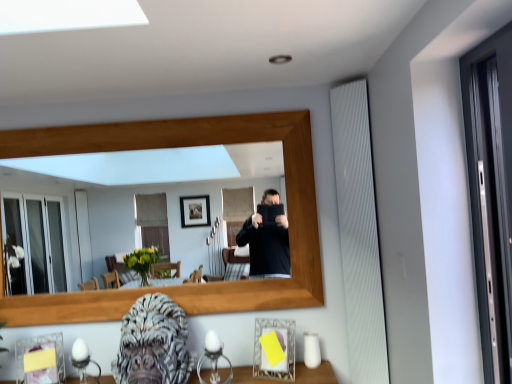
Question: From the image's perspective, would you say wooden frame at center is positioned over gray textured gorilla head at lower center?

Choices:
 (A) yes
 (B) no

Answer: (A)

Question: Does wooden frame at center have a smaller size compared to gray textured gorilla head at lower center?

Choices:
 (A) no
 (B) yes

Answer: (A)

Question: Is wooden frame at center at the right side of gray textured gorilla head at lower center?

Choices:
 (A) yes
 (B) no

Answer: (B)

Question: Is wooden frame at center taller than gray textured gorilla head at lower center?

Choices:
 (A) yes
 (B) no

Answer: (A)

Question: From a real-world perspective, is wooden frame at center beneath gray textured gorilla head at lower center?

Choices:
 (A) no
 (B) yes

Answer: (A)

Question: From a real-world perspective, is wooden frame at center on gray textured gorilla head at lower center?

Choices:
 (A) yes
 (B) no

Answer: (A)

Question: Can you confirm if gray textured gorilla head at lower center is positioned to the left of matte glass picture frame at lower right, which is counted as the 2th picture frame, starting from the left?

Choices:
 (A) no
 (B) yes

Answer: (B)

Question: Is gray textured gorilla head at lower center beside matte glass picture frame at lower right, which is counted as the 2th picture frame, starting from the left?

Choices:
 (A) no
 (B) yes

Answer: (A)

Question: Is gray textured gorilla head at lower center far from matte glass picture frame at lower right, which is counted as the 2th picture frame, starting from the left?

Choices:
 (A) no
 (B) yes

Answer: (A)

Question: Is gray textured gorilla head at lower center outside of matte glass picture frame at lower right, which is counted as the 2th picture frame, starting from the left?

Choices:
 (A) no
 (B) yes

Answer: (B)

Question: Does gray textured gorilla head at lower center have a greater width compared to matte glass picture frame at lower right, which is counted as the 2th picture frame, starting from the left?

Choices:
 (A) yes
 (B) no

Answer: (A)

Question: From a real-world perspective, is gray textured gorilla head at lower center on top of matte glass picture frame at lower right, which is counted as the 1th picture frame, starting from the right?

Choices:
 (A) no
 (B) yes

Answer: (B)

Question: From a real-world perspective, is matte glass picture frame at lower right, which is counted as the 1th picture frame, starting from the right, located higher than gray textured gorilla head at lower center?

Choices:
 (A) no
 (B) yes

Answer: (A)